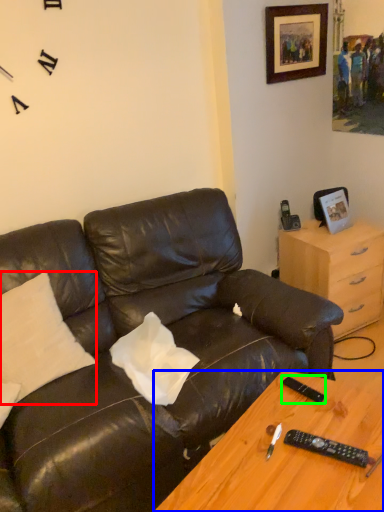
Question: Estimate the real-world distances between objects in this image. Which object is farther from pillow (highlighted by a red box), desk (highlighted by a blue box) or remote (highlighted by a green box)?

Choices:
 (A) desk
 (B) remote

Answer: (B)